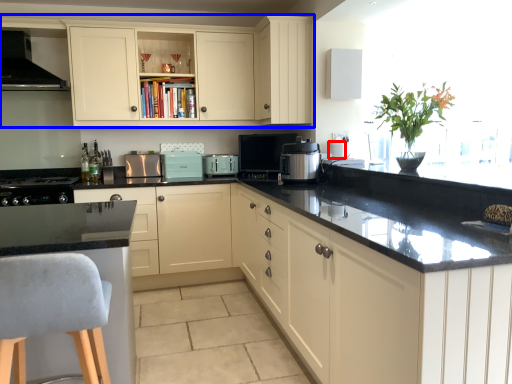
Question: Among these objects, which one is nearest to the camera, appliance (highlighted by a red box) or cabinetry (highlighted by a blue box)?

Choices:
 (A) appliance
 (B) cabinetry

Answer: (B)